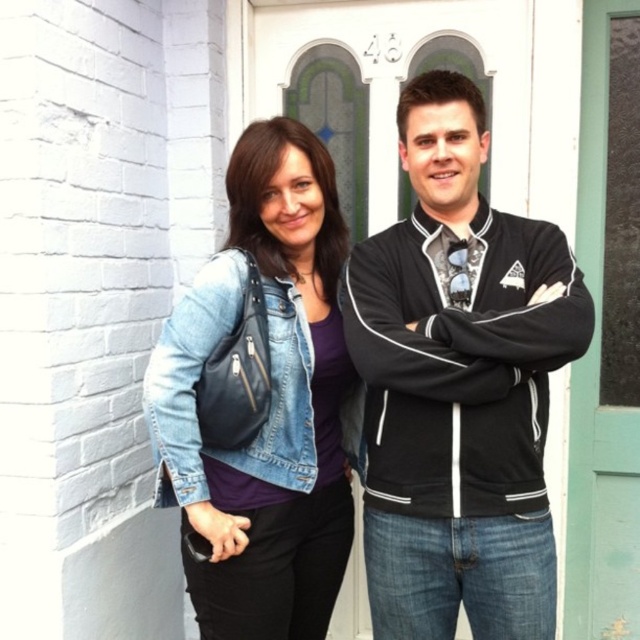
Question: Which object is closer to the camera taking this photo?

Choices:
 (A) denim jacket at center
 (B) denim jacket at lower left

Answer: (B)

Question: Observing the image, what is the correct spatial positioning of black fleece jacket at right in reference to denim jacket at center?

Choices:
 (A) left
 (B) right

Answer: (B)

Question: Is denim jacket at center to the right of denim jacket at lower left from the viewer's perspective?

Choices:
 (A) yes
 (B) no

Answer: (A)

Question: Which point appears closest to the camera in this image?

Choices:
 (A) (278, 394)
 (B) (413, 579)

Answer: (A)

Question: Which is farther from the black fleece jacket at right?

Choices:
 (A) denim jacket at center
 (B) denim jacket at lower left

Answer: (B)

Question: Does black fleece jacket at right appear on the right side of denim jacket at center?

Choices:
 (A) yes
 (B) no

Answer: (A)